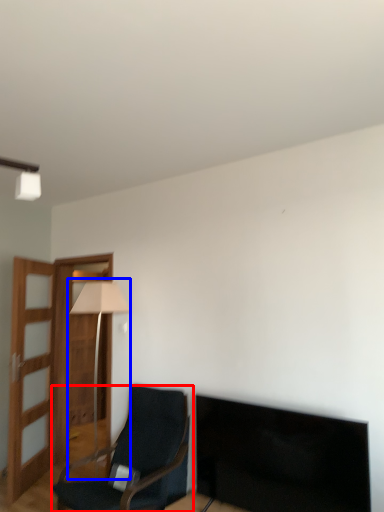
Question: Which object appears closest to the camera in this image, chair (highlighted by a red box) or table lamp (highlighted by a blue box)?

Choices:
 (A) chair
 (B) table lamp

Answer: (A)